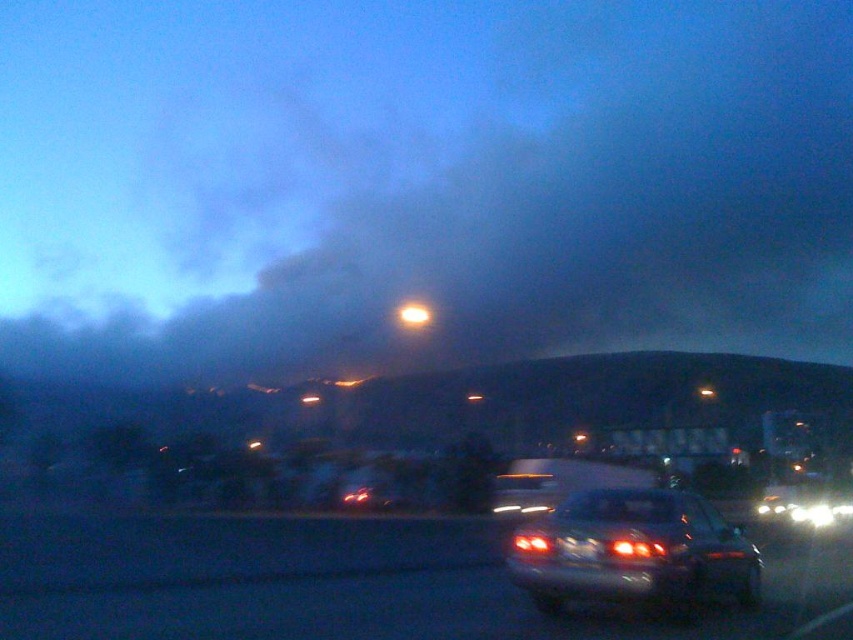
You are a pedestrian standing on the side of the road and see the metallic silver car at lower center and the matte silver sedan at center. Which car is closer to the left side of the road?

The metallic silver car at lower center is closer to the left side of the road because it is positioned to the left of the matte silver sedan at center.

You are a pedestrian standing on the side of the road in the image. You see the metallic silver car at lower center and the matte silver sedan at center. Which vehicle is taller?

The metallic silver car at lower center is much taller than the matte silver sedan at center.